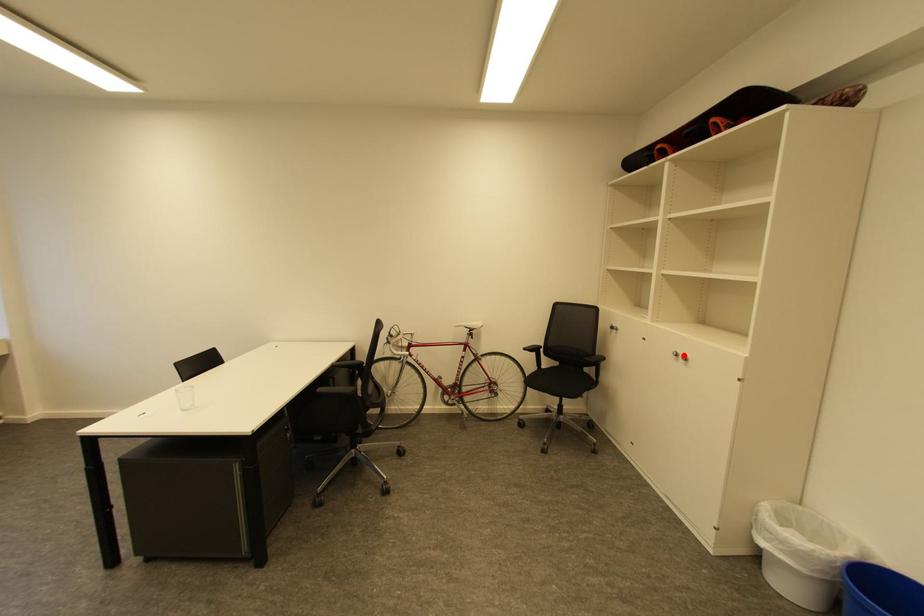
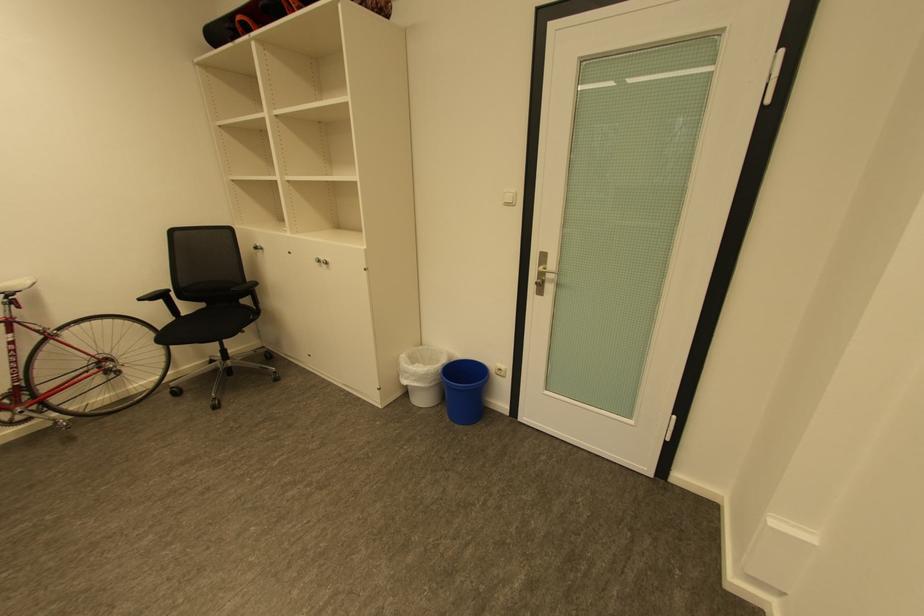
In the second image, find the point that corresponds to the highlighted location in the first image.

(325, 262)